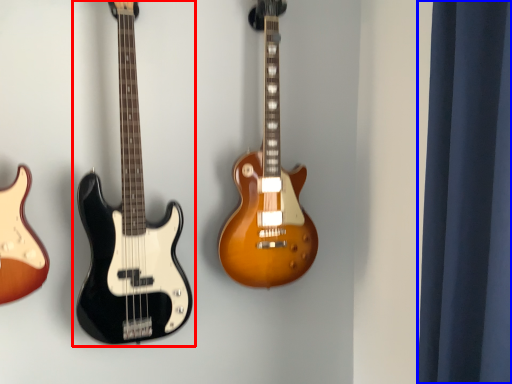
Question: Which point is closer to the camera, guitar (highlighted by a red box) or curtain (highlighted by a blue box)?

Choices:
 (A) guitar
 (B) curtain

Answer: (B)